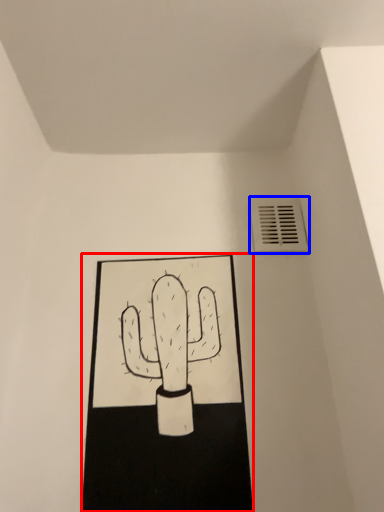
Question: Which point is further to the camera, sketch (highlighted by a red box) or air conditioning (highlighted by a blue box)?

Choices:
 (A) sketch
 (B) air conditioning

Answer: (B)